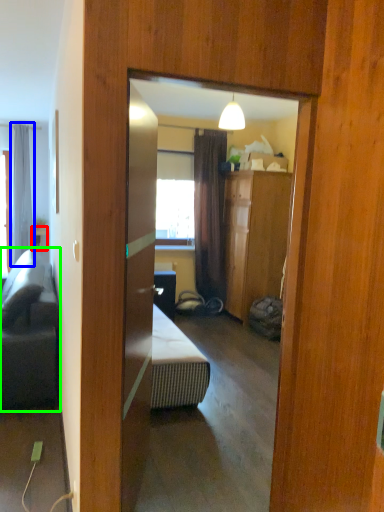
Question: Estimate the real-world distances between objects in this image. Which object is closer to table (highlighted by a red box), curtain (highlighted by a blue box) or studio couch (highlighted by a green box)?

Choices:
 (A) curtain
 (B) studio couch

Answer: (A)